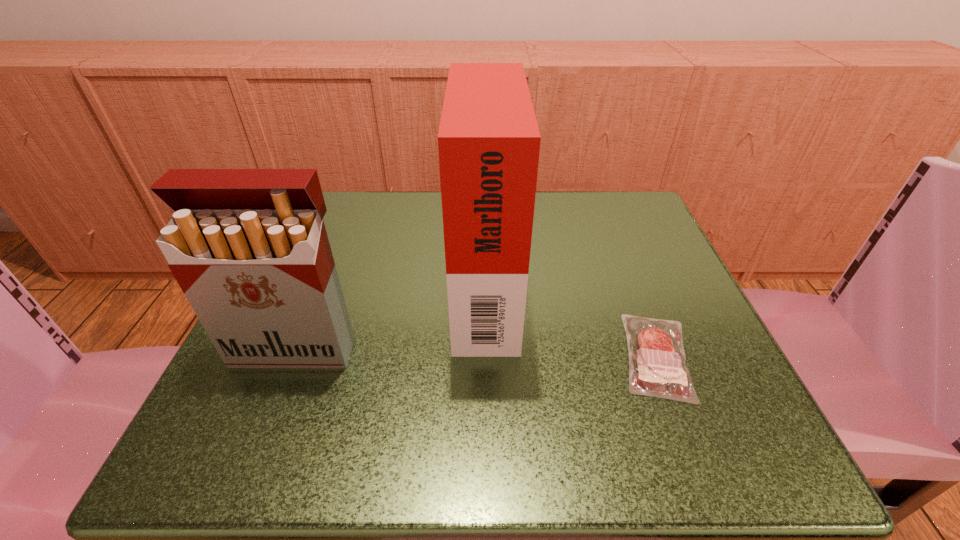
Find the location of a particular element. The image size is (960, 540). free space located 0.280m on the back of the shortest object is located at coordinates (606, 222).

At what (x,y) coordinates should I click in order to perform the action: click on object that is positioned at the far edge. Please return your answer as a coordinate pair (x, y). This screenshot has height=540, width=960. Looking at the image, I should click on (488, 141).

Locate an element on the screen. This screenshot has height=540, width=960. object that is at the near edge is located at coordinates (657, 363).

Find the location of a particular element. The image size is (960, 540). object that is at the left edge is located at coordinates (248, 247).

Locate an element on the screen. The image size is (960, 540). object situated at the right edge is located at coordinates (657, 363).

Image resolution: width=960 pixels, height=540 pixels. In order to click on object that is at the near right corner in this screenshot , I will do `click(657, 363)`.

The height and width of the screenshot is (540, 960). In order to click on free space at the far edge of the desktop in this screenshot , I will do `click(535, 253)`.

I want to click on vacant region at the near edge, so click(530, 433).

In the image, there is a desktop. Identify the location of vacant space at the left edge. (316, 372).

Locate an element on the screen. The image size is (960, 540). vacant space at the right edge of the desktop is located at coordinates (615, 257).